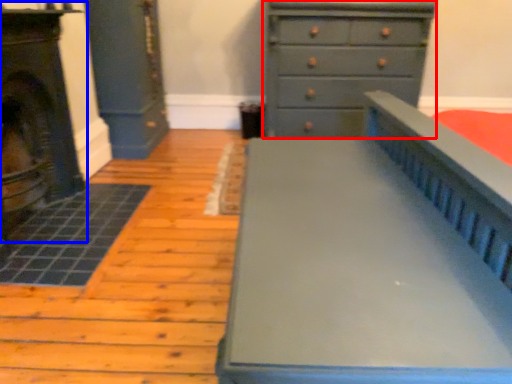
Question: Which of the following is the farthest to the observer, chest of drawers (highlighted by a red box) or fireplace (highlighted by a blue box)?

Choices:
 (A) chest of drawers
 (B) fireplace

Answer: (A)